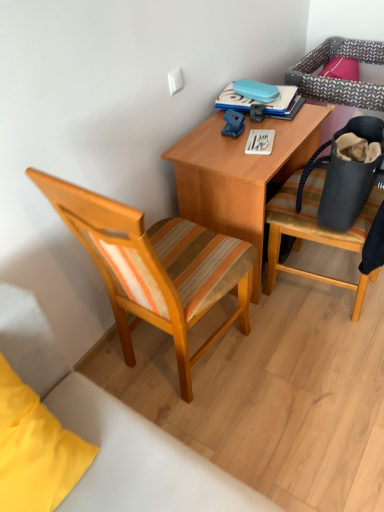
I want to click on vacant area located to the right-hand side of woodenchair at left, the first chair positioned from the left, so click(302, 369).